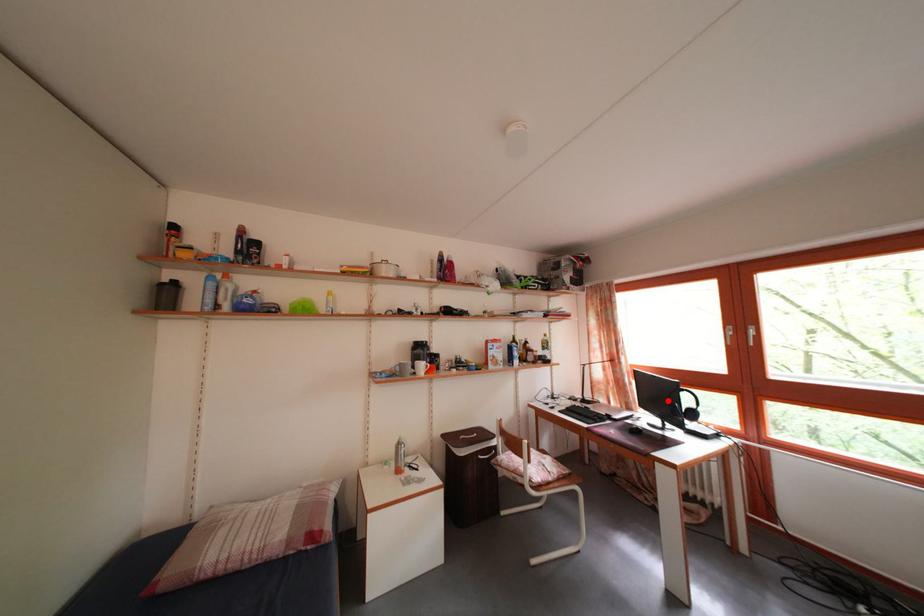
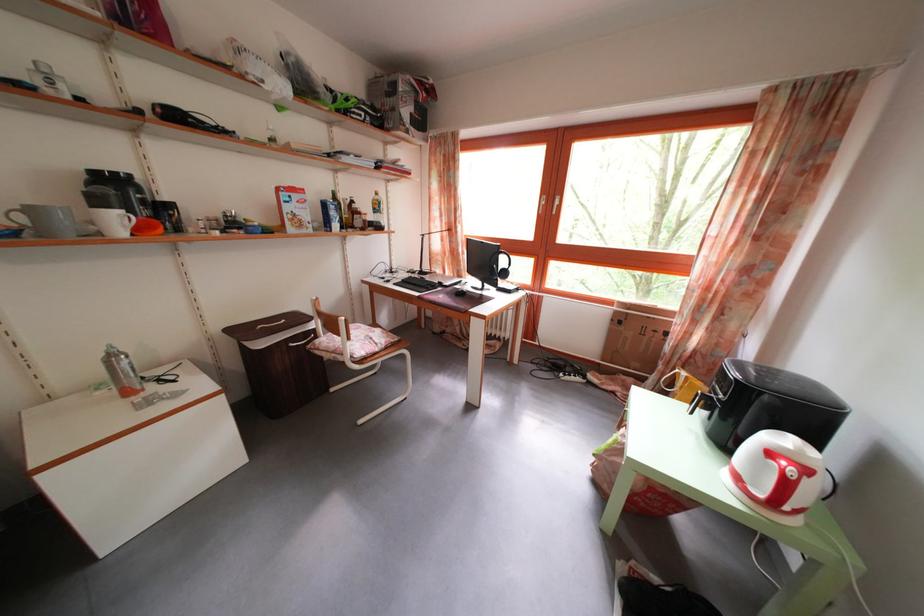
Question: I am providing you with two images of the same scene from different viewpoints. A red point is shown in image1. For the corresponding object point in image2, is it positioned nearer or farther from the camera?

Choices:
 (A) Nearer
 (B) Farther

Answer: (A)